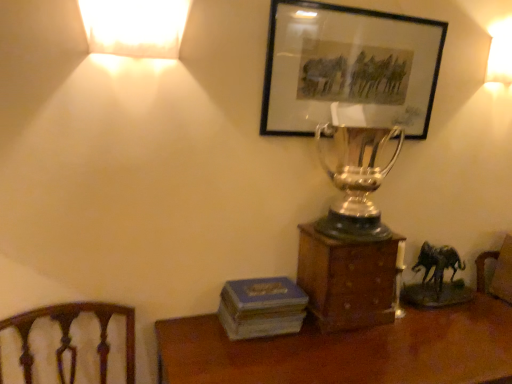
Question: Looking at their shapes, would you say blue matte book at lower center is wider or thinner than wooden desk at lower center?

Choices:
 (A) wide
 (B) thin

Answer: (B)

Question: Considering the positions of blue matte book at lower center and wooden desk at lower center in the image, is blue matte book at lower center taller or shorter than wooden desk at lower center?

Choices:
 (A) short
 (B) tall

Answer: (A)

Question: Which object is positioned closest to the wooden box at center?

Choices:
 (A) wooden desk at lower center
 (B) matte white lampshade at upper right, the 2th lamp positioned from the left
 (C) shiny silver trophy at center
 (D) matte black picture frame at upper center
 (E) blue matte book at lower center

Answer: (C)

Question: Estimate the real-world distances between objects in this image. Which object is farther from the wooden desk at lower center?

Choices:
 (A) matte black picture frame at upper center
 (B) blue matte book at lower center
 (C) shiny silver trophy at center
 (D) matte white lampshade at upper right, the 2th lamp viewed from the front
 (E) matte white lampshade at upper left, placed as the second lamp when sorted from back to front

Answer: (D)